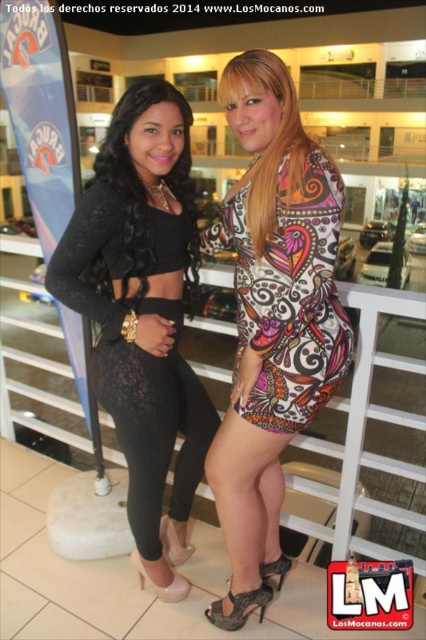
Question: Does printed fabric dress at center appear under matte black dress at center?

Choices:
 (A) no
 (B) yes

Answer: (B)

Question: Which object is farther from the camera taking this photo?

Choices:
 (A) printed fabric dress at center
 (B) black lace top at center
 (C) black lace dress at left

Answer: (B)

Question: Can you confirm if black lace dress at left is positioned to the left of multicolored printed dress at center?

Choices:
 (A) yes
 (B) no

Answer: (A)

Question: Considering the real-world distances, which object is farthest from the black lace leggings at center?

Choices:
 (A) matte black dress at center
 (B) black lace top at center

Answer: (A)

Question: Based on their relative distances, which object is nearer to the multicolored printed dress at center?

Choices:
 (A) black lace leggings at center
 (B) black lace top at center
 (C) black lace dress at left

Answer: (C)

Question: Does multicolored printed dress at center have a lesser width compared to matte black dress at center?

Choices:
 (A) no
 (B) yes

Answer: (A)